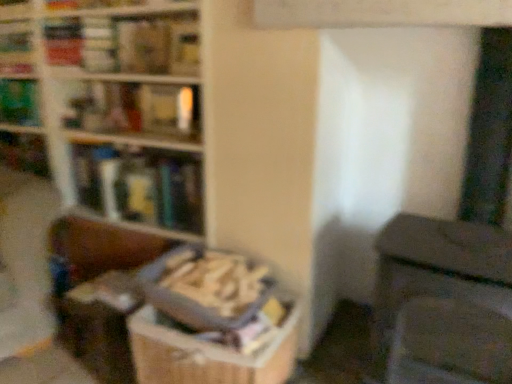
Question: Should I look upward or downward to see green matte book at upper left, the fourth book from the bottom?

Choices:
 (A) down
 (B) up

Answer: (B)

Question: Does wooden textured book at center, placed as the fifth book when sorted from top to bottom, have a greater height compared to hardcover book at upper center, arranged as the 5th book when ordered from the bottom?

Choices:
 (A) no
 (B) yes

Answer: (B)

Question: Considering the relative sizes of wooden textured book at center, which ranks as the 1th book in bottom-to-top order, and hardcover book at upper center, the first book viewed from the top, in the image provided, is wooden textured book at center, which ranks as the 1th book in bottom-to-top order, shorter than hardcover book at upper center, the first book viewed from the top,?

Choices:
 (A) yes
 (B) no

Answer: (B)

Question: Is the depth of wooden textured book at center, which ranks as the 1th book in bottom-to-top order, greater than that of hardcover book at upper center, the first book viewed from the top?

Choices:
 (A) yes
 (B) no

Answer: (B)

Question: Is wooden textured book at center, placed as the fifth book when sorted from top to bottom, beside hardcover book at upper center, arranged as the 5th book when ordered from the bottom?

Choices:
 (A) no
 (B) yes

Answer: (A)

Question: Considering the relative positions of wooden textured book at center, which ranks as the 1th book in bottom-to-top order, and hardcover book at upper center, the first book viewed from the top, in the image provided, is wooden textured book at center, which ranks as the 1th book in bottom-to-top order, to the right of hardcover book at upper center, the first book viewed from the top, from the viewer's perspective?

Choices:
 (A) no
 (B) yes

Answer: (B)

Question: Does wooden textured book at center, placed as the fifth book when sorted from top to bottom, turn towards hardcover book at upper center, arranged as the 5th book when ordered from the bottom?

Choices:
 (A) no
 (B) yes

Answer: (A)

Question: Can you confirm if hardcover book at upper left, which is counted as the third book, starting from the top, is smaller than wooden bookcase at upper left?

Choices:
 (A) yes
 (B) no

Answer: (A)

Question: Can you confirm if hardcover book at upper left, which is counted as the third book, starting from the top, is shorter than wooden bookcase at upper left?

Choices:
 (A) no
 (B) yes

Answer: (B)

Question: Is hardcover book at upper left, which is counted as the third book, starting from the top, further to the viewer compared to wooden bookcase at upper left?

Choices:
 (A) yes
 (B) no

Answer: (A)

Question: Is hardcover book at upper left, which is counted as the third book, starting from the top, looking in the opposite direction of wooden bookcase at upper left?

Choices:
 (A) yes
 (B) no

Answer: (A)

Question: Can you confirm if hardcover book at upper left, placed as the third book when sorted from bottom to top, is wider than wooden bookcase at upper left?

Choices:
 (A) yes
 (B) no

Answer: (B)

Question: From the image's perspective, would you say hardcover book at upper left, placed as the third book when sorted from bottom to top, is positioned over wooden bookcase at upper left?

Choices:
 (A) yes
 (B) no

Answer: (A)

Question: Is hardcover book at upper left, which is counted as the third book, starting from the top, taller than green matte book at upper left, the fourth book from the bottom?

Choices:
 (A) no
 (B) yes

Answer: (A)